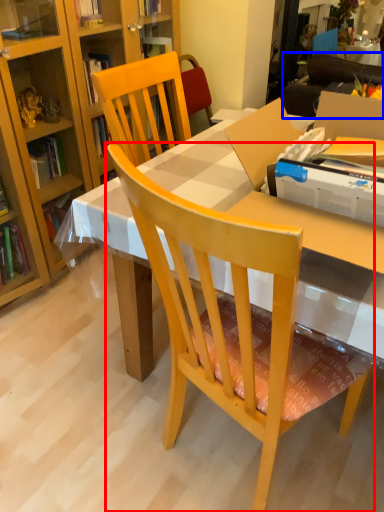
Question: Which object appears farthest to the camera in this image, chair (highlighted by a red box) or studio couch (highlighted by a blue box)?

Choices:
 (A) chair
 (B) studio couch

Answer: (B)